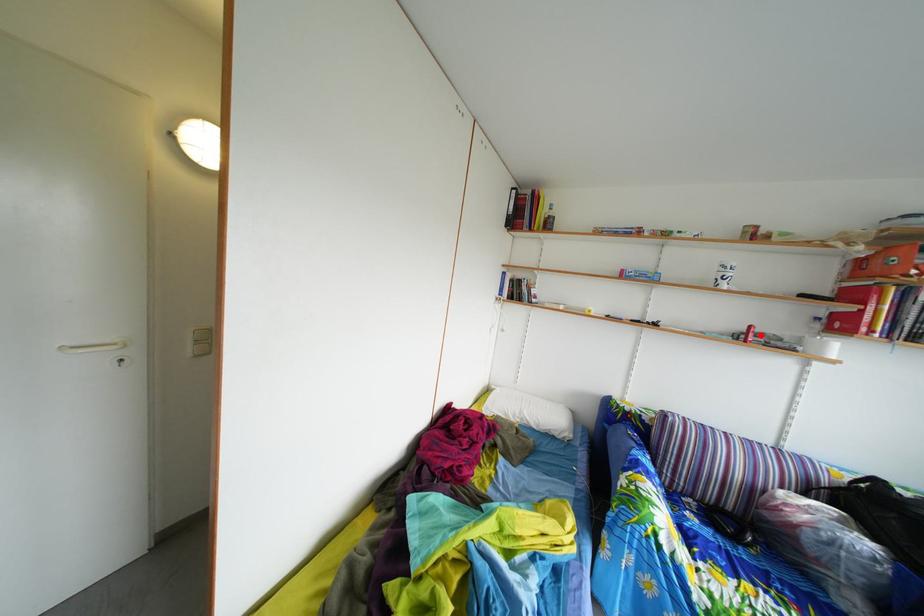
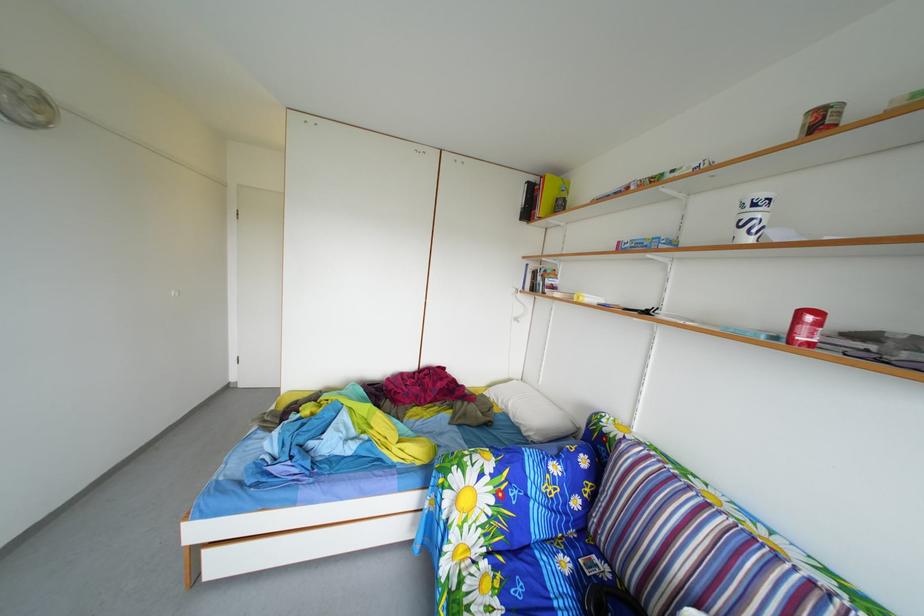
In the second image, find the point that corresponds to the highlighted location in the first image.

(811, 321)